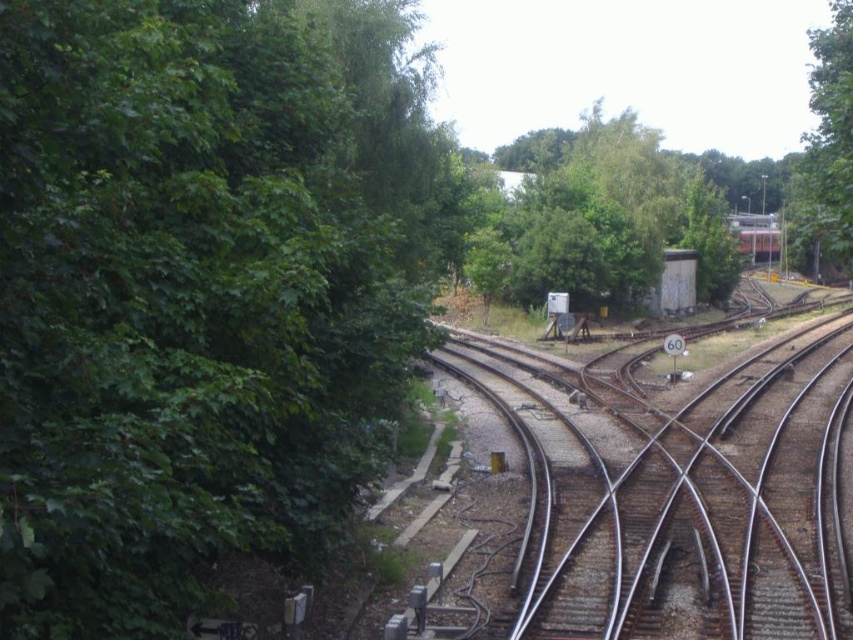
Is green leafy tree at left closer to the viewer compared to metallic red train at center?

Yes, green leafy tree at left is in front of metallic red train at center.

What do you see at coordinates (201, 289) in the screenshot? I see `green leafy tree at left` at bounding box center [201, 289].

Find the location of a particular element. Image resolution: width=853 pixels, height=640 pixels. green leafy tree at left is located at coordinates (201, 289).

How distant is green leafy tree at center from metallic red train at center?

A distance of 16.33 meters exists between green leafy tree at center and metallic red train at center.

This screenshot has height=640, width=853. Identify the location of green leafy tree at center. (610, 221).

Who is more distant from viewer, (721, 268) or (775, 230)?

Point (775, 230)

The image size is (853, 640). In order to click on green leafy tree at center in this screenshot , I will do `click(610, 221)`.

Is green leafy tree at left behind green leafy tree at upper right?

No, it is not.

Is green leafy tree at left taller than green leafy tree at upper right?

No.

Who is more distant from viewer, (120, 614) or (845, 58)?

Point (845, 58)

Where is `green leafy tree at left`? The image size is (853, 640). green leafy tree at left is located at coordinates (201, 289).